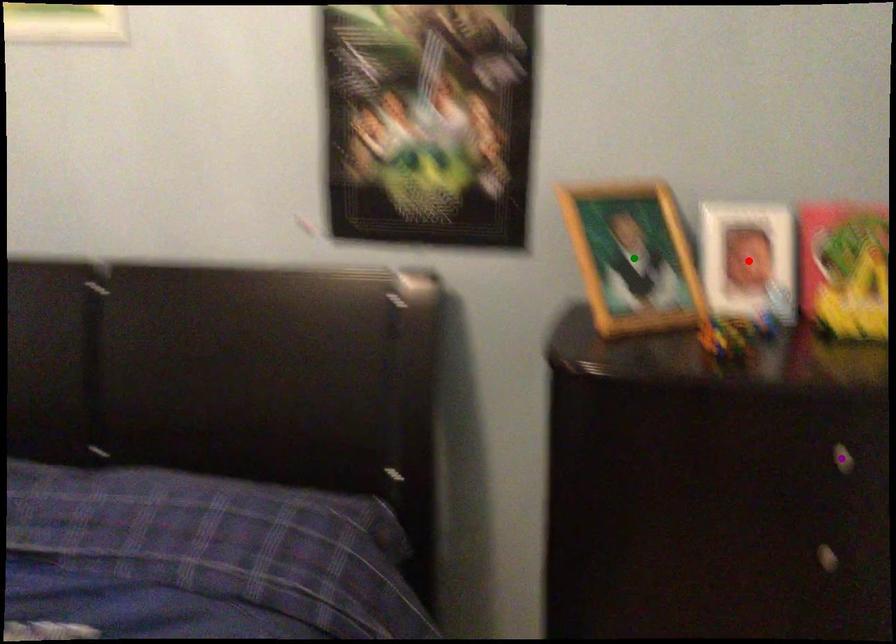
Order these from nearest to farthest:
purple point | green point | red point

purple point
green point
red point